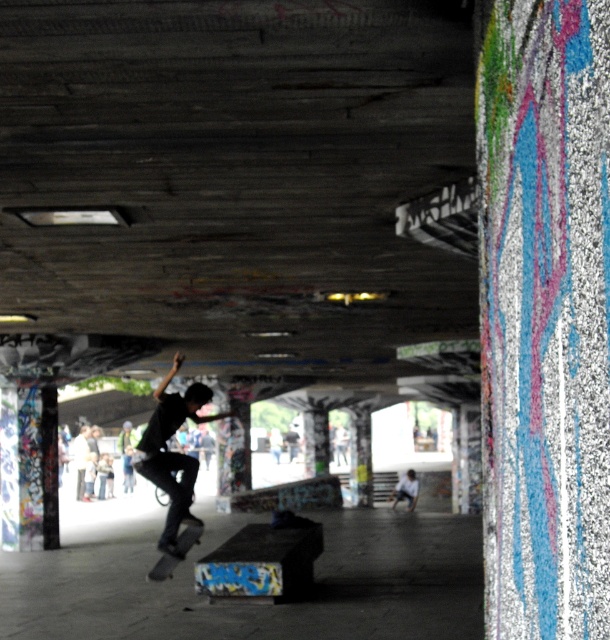
Consider the image. Does black matte skateboarder at center lie behind black matte skateboard at lower center?

No, black matte skateboarder at center is in front of black matte skateboard at lower center.

Is point (156, 424) positioned behind point (201, 525)?

No, it is not.

Where is `black matte skateboarder at center`? black matte skateboarder at center is located at coordinates (173, 452).